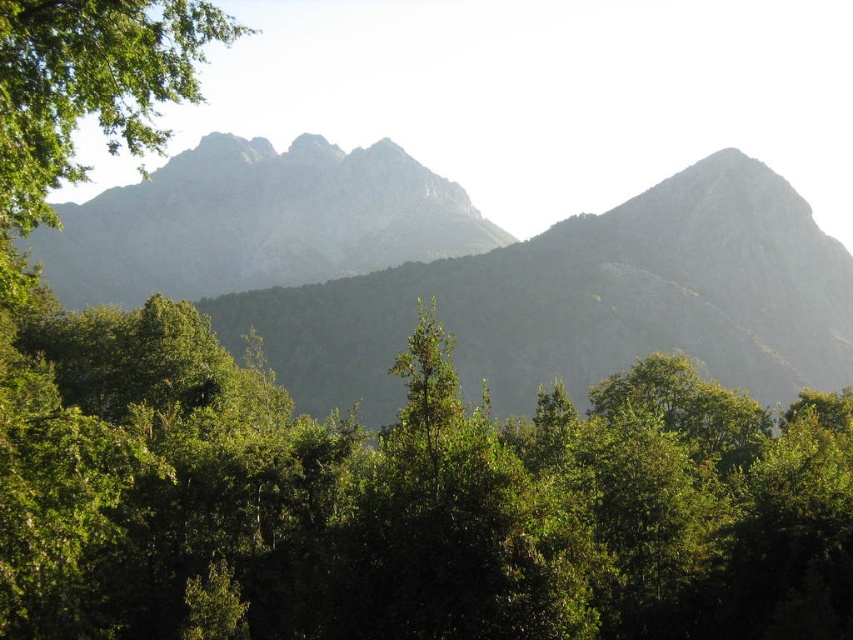
Between gray rocky mountain range at upper center and gray rocky mountain at center, which one has more height?

With more height is gray rocky mountain range at upper center.

Does gray rocky mountain range at upper center have a larger size compared to gray rocky mountain at center?

Indeed, gray rocky mountain range at upper center has a larger size compared to gray rocky mountain at center.

Who is more distant from viewer, [735,182] or [222,237]?

The point [222,237] is behind.

At what (x,y) coordinates should I click in order to perform the action: click on gray rocky mountain range at upper center. Please return your answer as a coordinate pair (x, y). Looking at the image, I should click on (467, 273).

Where is `gray rocky mountain at center`? This screenshot has width=853, height=640. gray rocky mountain at center is located at coordinates (256, 221).

Is point (300, 248) positioned in front of point (65, 125)?

No, it is behind (65, 125).

What do you see at coordinates (256, 221) in the screenshot?
I see `gray rocky mountain at center` at bounding box center [256, 221].

I want to click on gray rocky mountain at center, so click(256, 221).

Is gray rocky mountain range at upper center positioned in front of green leafy tree at upper left?

No, it is behind green leafy tree at upper left.

Measure the distance between gray rocky mountain range at upper center and camera.

gray rocky mountain range at upper center and camera are 124.87 meters apart from each other.

This screenshot has height=640, width=853. What are the coordinates of `gray rocky mountain range at upper center` in the screenshot? It's located at (467, 273).